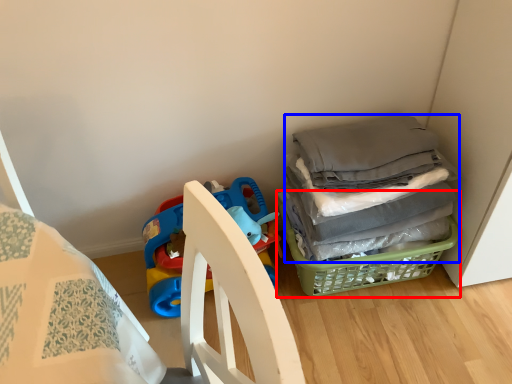
Question: Which object appears farthest to the camera in this image, basket (highlighted by a red box) or clothing (highlighted by a blue box)?

Choices:
 (A) basket
 (B) clothing

Answer: (A)